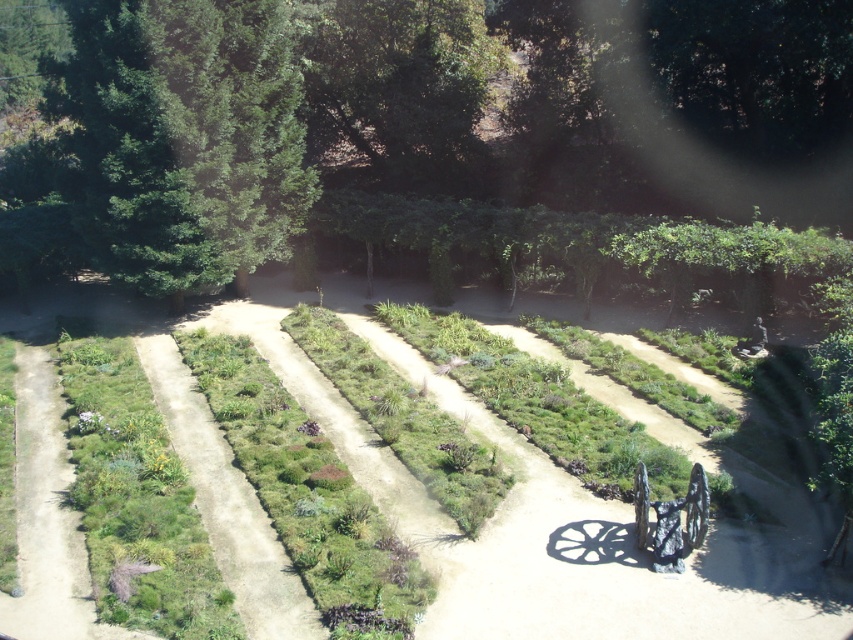
Is point (540, 36) less distant than point (67, 573)?

No, it is not.

Which is behind, point (294, 26) or point (51, 374)?

The point (294, 26) is more distant.

Which is in front, point (549, 51) or point (22, 573)?

Point (22, 573) is more forward.

The image size is (853, 640). Find the location of `green leafy tree at upper center`. green leafy tree at upper center is located at coordinates 512,96.

Between point (257, 224) and point (634, 508), which one is positioned behind?

Positioned behind is point (257, 224).

Does green leafy tree at upper left have a lesser height compared to shiny metallic wagon at center?

Incorrect, green leafy tree at upper left's height does not fall short of shiny metallic wagon at center's.

Is point (281, 6) positioned after point (688, 483)?

Yes.

Image resolution: width=853 pixels, height=640 pixels. What are the coordinates of `green leafy tree at upper left` in the screenshot? It's located at (184, 136).

Looking at this image, does green leafy tree at upper center come behind green leafy tree at upper left?

Yes, green leafy tree at upper center is further from the viewer.

In order to click on green leafy tree at upper center in this screenshot , I will do `click(512, 96)`.

Which is behind, point (628, 202) or point (212, 225)?

The point (628, 202) is more distant.

Identify the location of green leafy tree at upper center. click(512, 96).